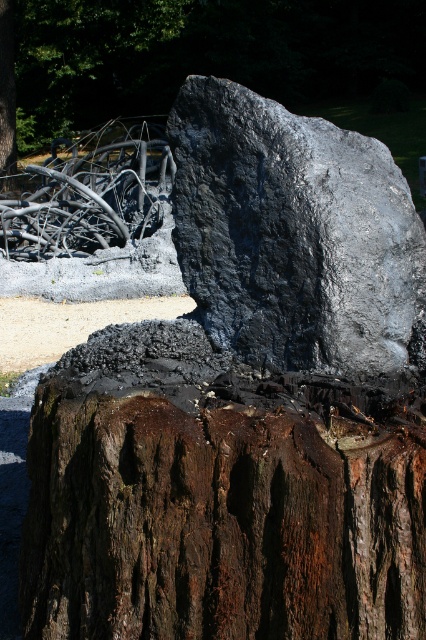
Question: Which point is closer to the camera taking this photo?

Choices:
 (A) (178, 120)
 (B) (11, 129)
 (C) (423, 602)

Answer: (C)

Question: Which point is farther from the camera taking this photo?

Choices:
 (A) (249, 237)
 (B) (238, 406)

Answer: (A)

Question: Which point is closer to the camera?

Choices:
 (A) (273, 588)
 (B) (13, 80)

Answer: (A)

Question: Does rusty wood tree trunk at center appear under brown rough tree trunk at center?

Choices:
 (A) no
 (B) yes

Answer: (B)

Question: Is rusty wood tree trunk at center thinner than black polished rock at center?

Choices:
 (A) yes
 (B) no

Answer: (B)

Question: Does black polished rock at center come in front of brown rough tree trunk at center?

Choices:
 (A) yes
 (B) no

Answer: (A)